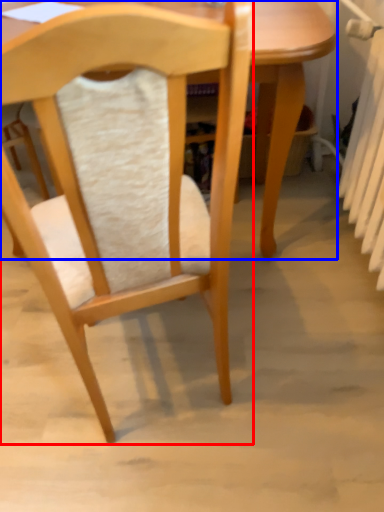
Question: Which object is closer to the camera taking this photo, chair (highlighted by a red box) or table (highlighted by a blue box)?

Choices:
 (A) chair
 (B) table

Answer: (A)